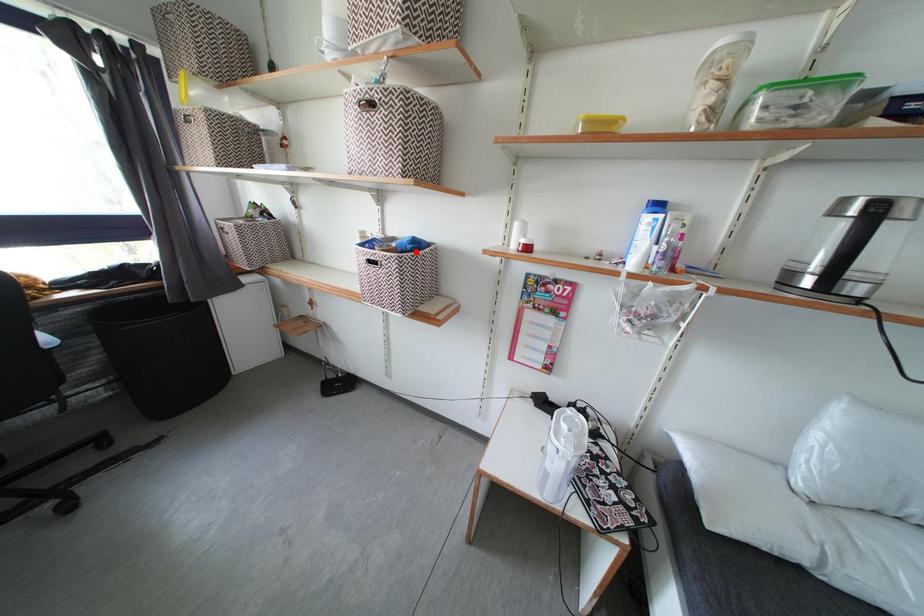
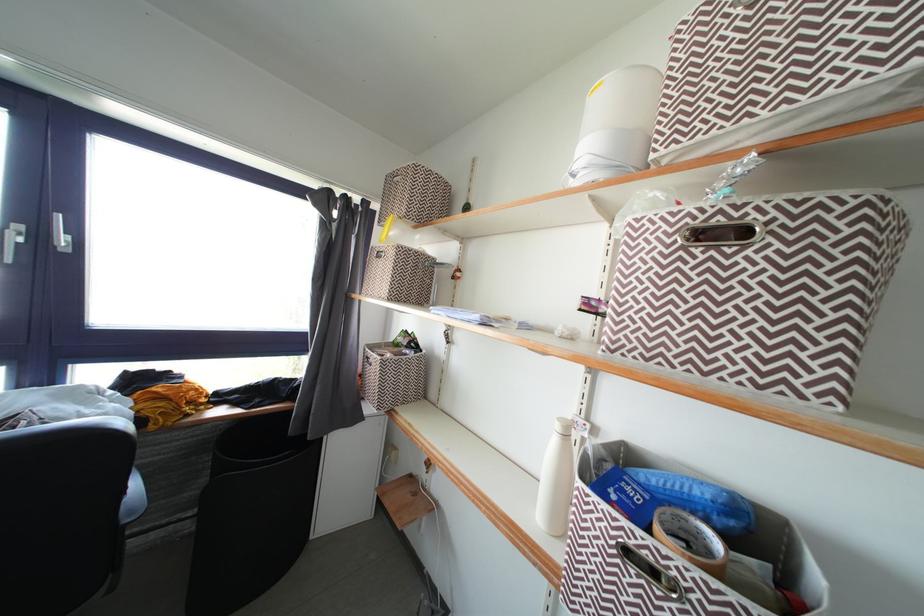
In the second image, find the point that corresponds to the highlighted location in the first image.

(724, 525)